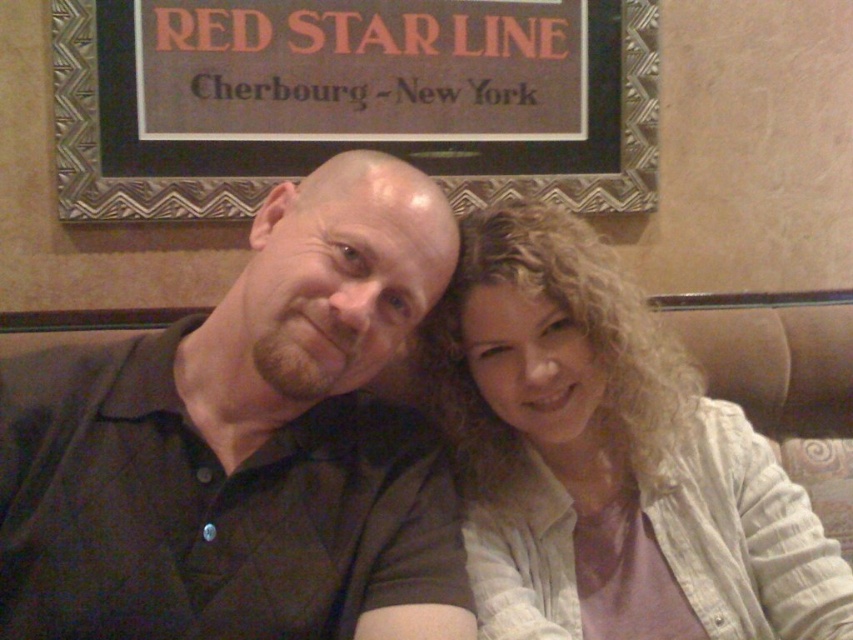
Can you confirm if dark green shirt at left is bigger than light beige fabric shirt at center?

Actually, dark green shirt at left might be smaller than light beige fabric shirt at center.

Which is below, dark green shirt at left or light beige fabric shirt at center?

light beige fabric shirt at center

Measure the distance between dark green shirt at left and camera.

dark green shirt at left is 29.85 inches away from camera.

Find the location of a particular element. The height and width of the screenshot is (640, 853). dark green shirt at left is located at coordinates (247, 445).

Is light beige fabric shirt at center positioned at the back of metallic signboard at upper center?

No, it is in front of metallic signboard at upper center.

Who is more forward, (541,572) or (616,177)?

Point (541,572)

Is point (474, 348) farther from camera compared to point (459, 186)?

No, (474, 348) is closer to viewer.

Locate an element on the screen. Image resolution: width=853 pixels, height=640 pixels. light beige fabric shirt at center is located at coordinates (608, 458).

Is point (20, 593) behind point (630, 42)?

No, it is not.

Between dark green shirt at left and metallic signboard at upper center, which one appears on the right side from the viewer's perspective?

From the viewer's perspective, dark green shirt at left appears more on the right side.

Where is `dark green shirt at left`? This screenshot has height=640, width=853. dark green shirt at left is located at coordinates (247, 445).